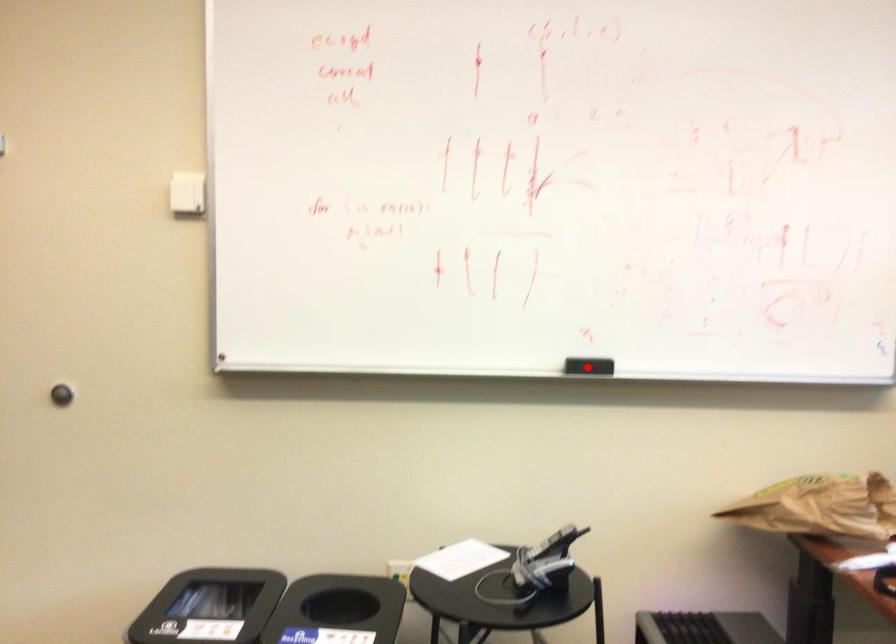
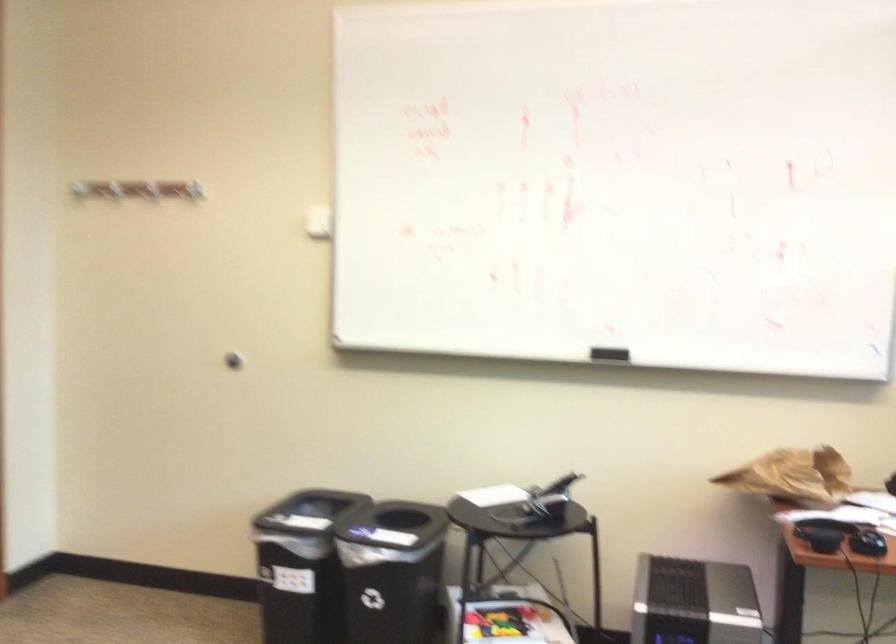
Locate, in the second image, the point that corresponds to the highlighted location in the first image.

(608, 354)